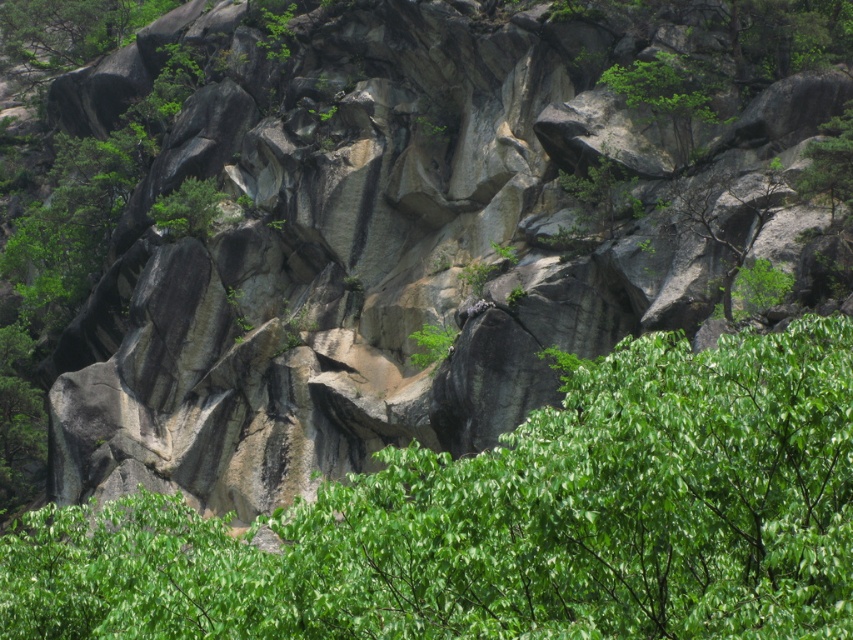
Question: Is green leafy tree at center thinner than green leafy tree at upper center?

Choices:
 (A) no
 (B) yes

Answer: (A)

Question: Is green leafy tree at center above green leafy tree at upper center?

Choices:
 (A) yes
 (B) no

Answer: (B)

Question: Which of the following is the closest to the observer?

Choices:
 (A) green leafy tree at upper center
 (B) green leafy tree at center
 (C) green leafy tree at upper right

Answer: (B)

Question: Among these points, which one is farthest from the camera?

Choices:
 (A) (317, 593)
 (B) (682, 72)
 (C) (805, 189)

Answer: (B)

Question: Which point is farther from the camera taking this photo?

Choices:
 (A) (648, 99)
 (B) (822, 170)
 (C) (759, 490)

Answer: (A)

Question: In this image, where is green leafy tree at center located relative to green leafy tree at upper right?

Choices:
 (A) right
 (B) left

Answer: (B)